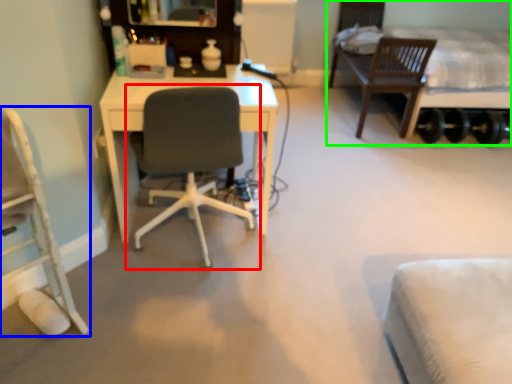
Question: Considering the real-world distances, which object is farthest from chair (highlighted by a red box)? chair (highlighted by a blue box) or bed (highlighted by a green box)?

Choices:
 (A) chair
 (B) bed

Answer: (B)